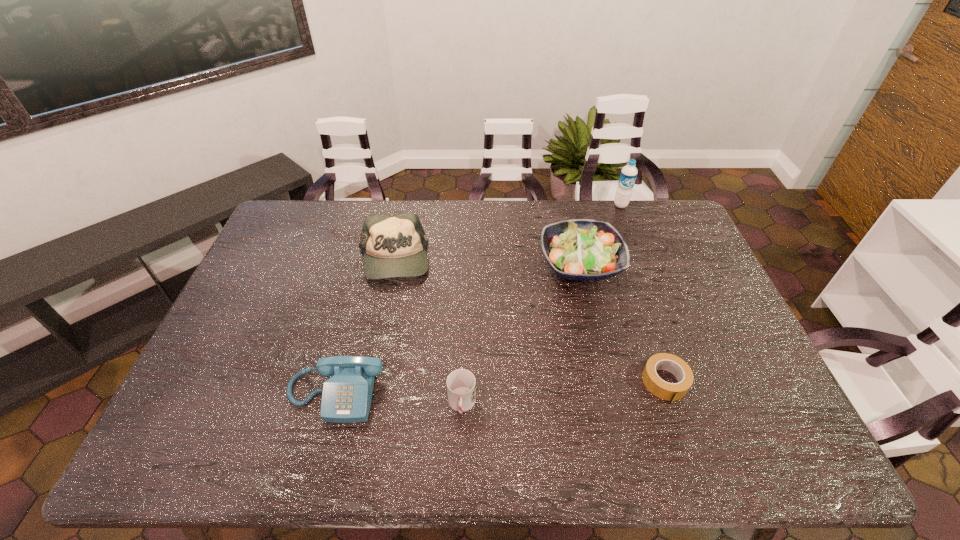
Image resolution: width=960 pixels, height=540 pixels. I want to click on vacant space at the far right corner of the desktop, so click(667, 201).

Locate an element on the screen. The height and width of the screenshot is (540, 960). empty space between the duct tape and the fourth object from right to left is located at coordinates (564, 394).

This screenshot has width=960, height=540. Identify the location of empty location between the shortest object and the baseball cap. (529, 321).

At what (x,y) coordinates should I click in order to perform the action: click on free space between the tallest object and the telephone. Please return your answer as a coordinate pair (x, y). Image resolution: width=960 pixels, height=540 pixels. Looking at the image, I should click on (478, 299).

Identify the location of free space that is in between the fourth object from right to left and the tallest object. (541, 305).

The height and width of the screenshot is (540, 960). What are the coordinates of `free space between the baseball cap and the telephone` in the screenshot? It's located at (364, 327).

Find the location of `vacant point located between the salad plate and the duct tape`. vacant point located between the salad plate and the duct tape is located at coordinates (623, 323).

What are the coordinates of `free space that is in between the baseball cap and the shortest object` in the screenshot? It's located at (529, 321).

This screenshot has width=960, height=540. Identify the location of free space between the fourth object from right to left and the baseball cap. (427, 333).

This screenshot has height=540, width=960. I want to click on free spot between the duct tape and the telephone, so click(x=500, y=388).